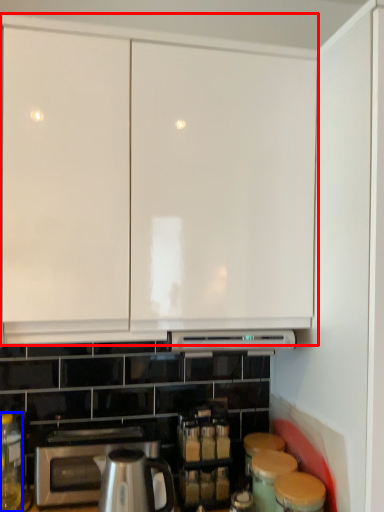
Question: Which object appears farthest to the camera in this image, cabinetry (highlighted by a red box) or bottle (highlighted by a blue box)?

Choices:
 (A) cabinetry
 (B) bottle

Answer: (B)